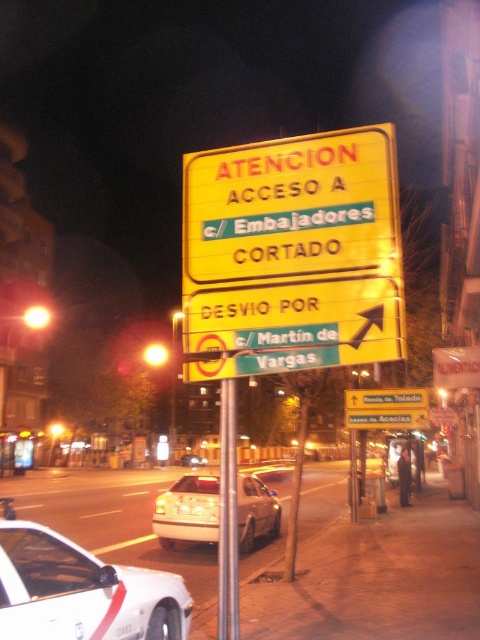
Consider the image. You are a driver approaching the intersection and see the yellow plastic sign at center and the yellow matte sign at upper center. Which one is smaller in size?

The yellow plastic sign at center has a smaller size compared to the yellow matte sign at upper center.

You are driving a car and see the white glossy car at lower left and the yellow plastic sign at center. According to the scene, which object is positioned to the left of the other?

The white glossy car at lower left is to the left of the yellow plastic sign at center.

You are a delivery driver who needs to deliver a package to the closed street. You see a white metallic sedan at center and a yellow plastic sign at center. Which object should you pay attention to for detour instructions?

The yellow plastic sign at center provides detour instructions, so you should pay attention to it.